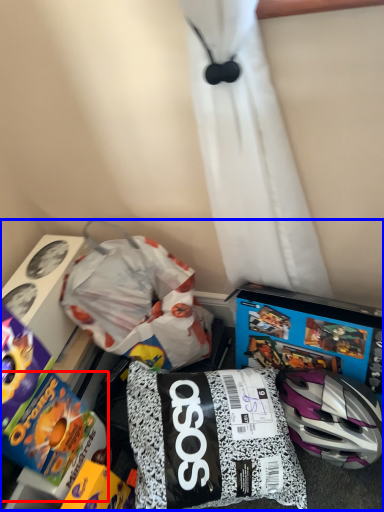
Question: Which of the following is the farthest to the observer, toy (highlighted by a red box) or toy (highlighted by a blue box)?

Choices:
 (A) toy
 (B) toy

Answer: (A)